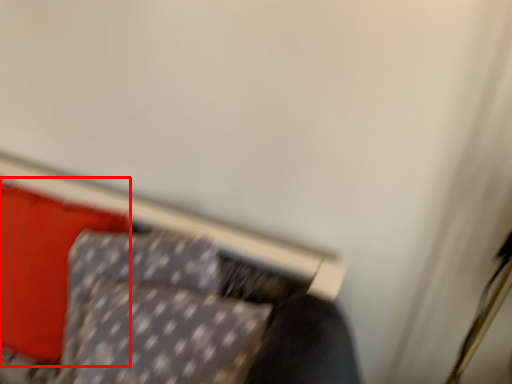
Question: In this image, where is pillow (annotated by the red box) located relative to furniture?

Choices:
 (A) left
 (B) right

Answer: (A)